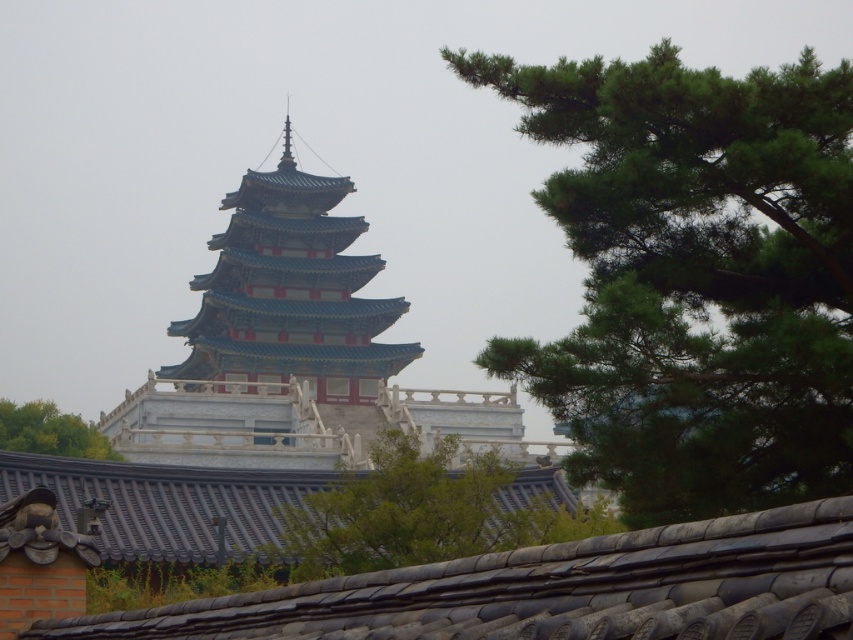
You are standing in front of the pagoda and notice a gray tile roof at lower center and a green leafy tree at lower left. Which object is positioned to the right of the other?

The gray tile roof at lower center is to the right of the green leafy tree at lower left.

You are standing at the entrance of the pagoda and notice the gray tile roof at lower center and the green leafy tree at lower left. Which object is shorter?

The gray tile roof at lower center is shorter than the green leafy tree at lower left.

You are standing in front of a traditional East Asian pagoda with multiple tiers. You notice a specific point marked at coordinates [166,502]. What is located at this point?

At point [166,502] lies shiny dark gray tiles at center.